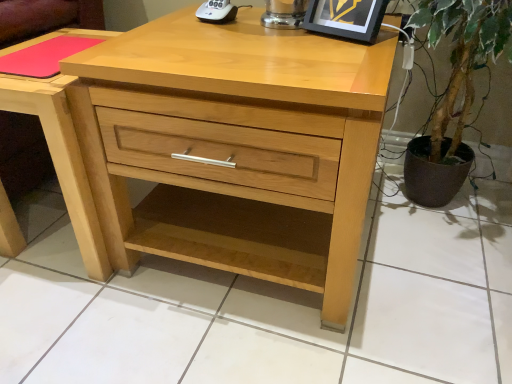
Where is `free spot to the right of white plastic remote control at upper center`? free spot to the right of white plastic remote control at upper center is located at coordinates (259, 24).